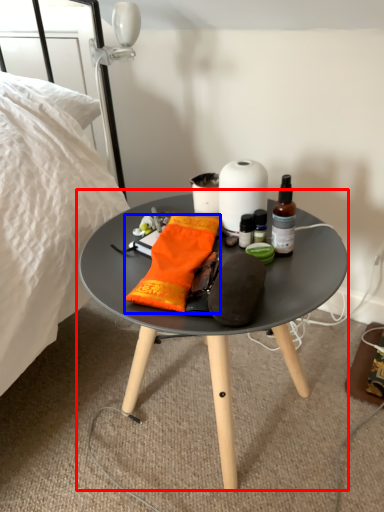
Question: Which object is closer to the camera taking this photo, coffee table (highlighted by a red box) or material (highlighted by a blue box)?

Choices:
 (A) coffee table
 (B) material

Answer: (A)